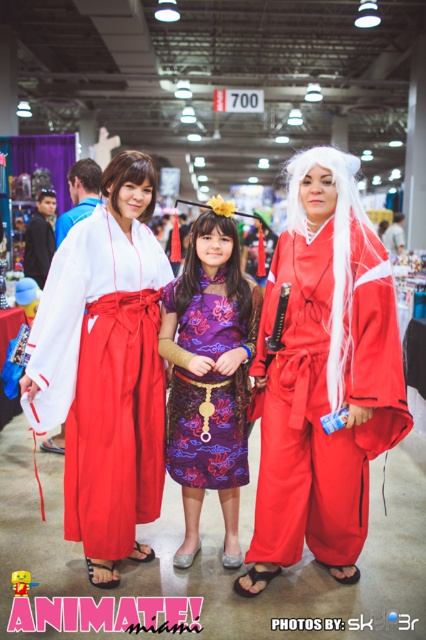
Is matte red kimono at center to the right of white cotton kimono at center from the viewer's perspective?

Indeed, matte red kimono at center is positioned on the right side of white cotton kimono at center.

Which of these two, matte red kimono at center or white cotton kimono at center, stands taller?

Standing taller between the two is matte red kimono at center.

I want to click on matte red kimono at center, so click(324, 376).

Between matte red kimono at center and purple satin dress at center, which one is positioned lower?

Positioned lower is purple satin dress at center.

Between point (350, 506) and point (207, 436), which one is positioned in front?

Point (350, 506)

Is point (296, 550) farther from camera compared to point (189, 500)?

No, it is not.

The width and height of the screenshot is (426, 640). Find the location of `matte red kimono at center`. matte red kimono at center is located at coordinates (324, 376).

Find the location of a particular element. white cotton kimono at center is located at coordinates (106, 369).

Who is more forward, (94, 392) or (193, 467)?

Point (94, 392)

Identify the location of white cotton kimono at center. (106, 369).